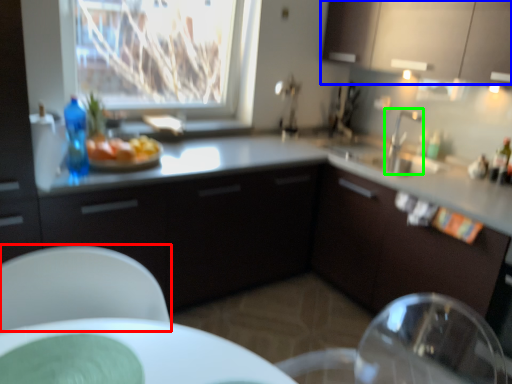
Question: Estimate the real-world distances between objects in this image. Which object is closer to chair (highlighted by a red box), cabinetry (highlighted by a blue box) or tap (highlighted by a green box)?

Choices:
 (A) cabinetry
 (B) tap

Answer: (B)